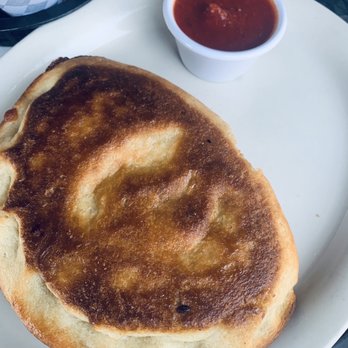
Find the location of `bowl`. bowl is located at coordinates (227, 67).